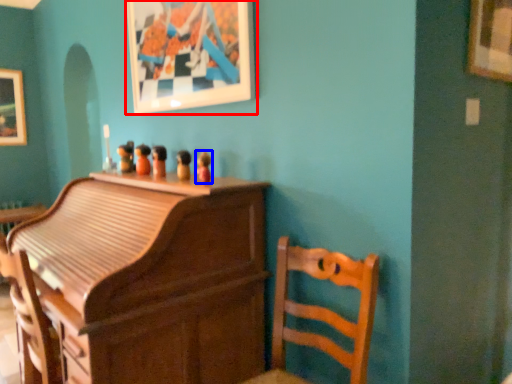
Question: Which of the following is the closest to the observer, picture frame (highlighted by a red box) or toy (highlighted by a blue box)?

Choices:
 (A) picture frame
 (B) toy

Answer: (A)